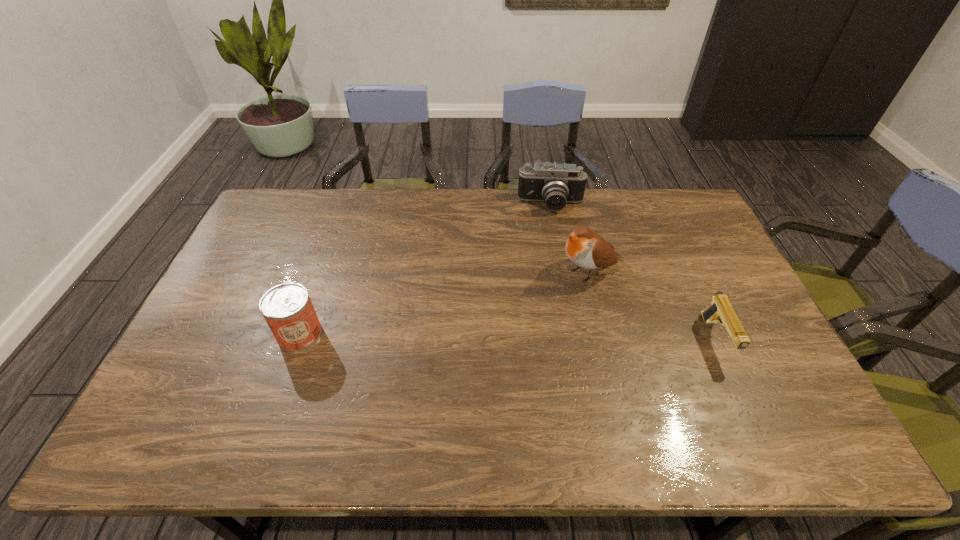
Image resolution: width=960 pixels, height=540 pixels. Identify the location of the second closest object relative to the leftmost object. (556, 184).

Identify which object is the closest to the third nearest object. Please provide its 2D coordinates. Your answer should be formatted as a tuple, i.e. [(x, y)], where the tuple contains the x and y coordinates of a point satisfying the conditions above.

[(556, 184)]